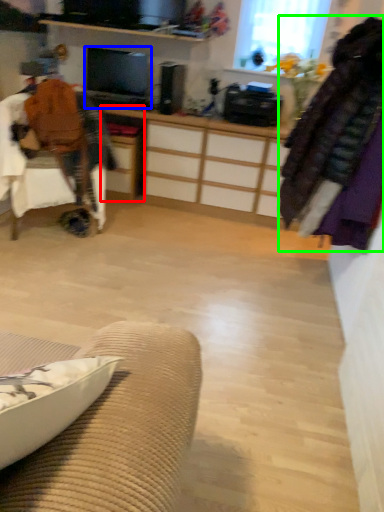
Question: Estimate the real-world distances between objects in this image. Which object is closer to desk (highlighted by a red box), television (highlighted by a blue box) or clothing (highlighted by a green box)?

Choices:
 (A) television
 (B) clothing

Answer: (A)